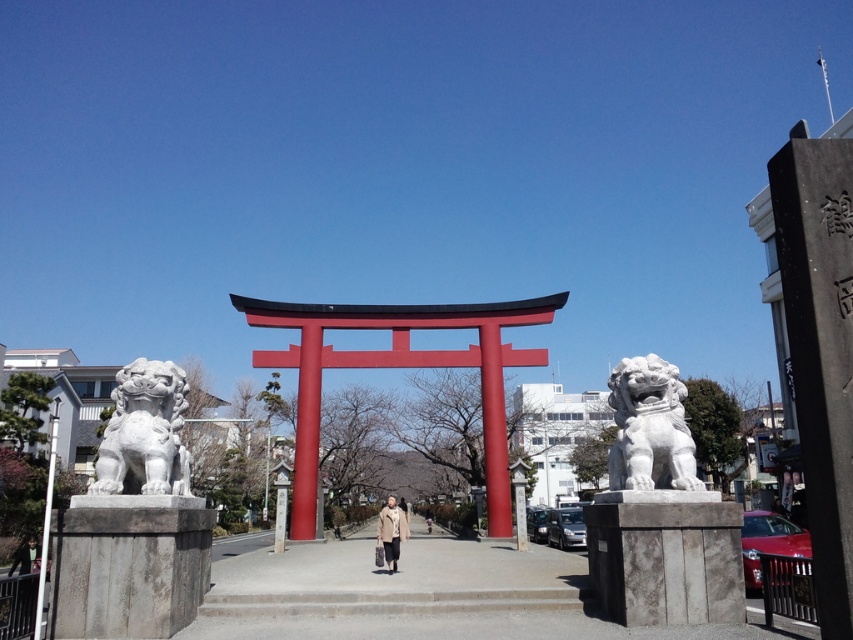
Is white stone lion at left closer to camera compared to light brown textured coat at center?

Yes, white stone lion at left is in front of light brown textured coat at center.

Who is more forward, (165, 401) or (402, 522)?

Point (165, 401) is in front.

Is point (102, 488) in front of point (396, 518)?

Yes, point (102, 488) is closer to viewer.

You are a GUI agent. You are given a task and a screenshot of the screen. Output one action in this format:
    pyautogui.click(x=<x>, y=<y>)
    Task: Click on the white stone lion at left
    Image resolution: width=853 pixels, height=640 pixels.
    Given the screenshot: What is the action you would take?
    pyautogui.click(x=144, y=433)

Consider the image. Can you confirm if white stone lion at center is shorter than light brown textured coat at center?

Yes, white stone lion at center is shorter than light brown textured coat at center.

The height and width of the screenshot is (640, 853). What do you see at coordinates (650, 435) in the screenshot? I see `white stone lion at center` at bounding box center [650, 435].

Where is `white stone lion at center`? The height and width of the screenshot is (640, 853). white stone lion at center is located at coordinates (650, 435).

Which is more to the right, white stone lion at center or white stone lion at left?

white stone lion at center

Can you confirm if white stone lion at center is thinner than white stone lion at left?

Yes, white stone lion at center is thinner than white stone lion at left.

This screenshot has height=640, width=853. In order to click on white stone lion at center in this screenshot , I will do `click(650, 435)`.